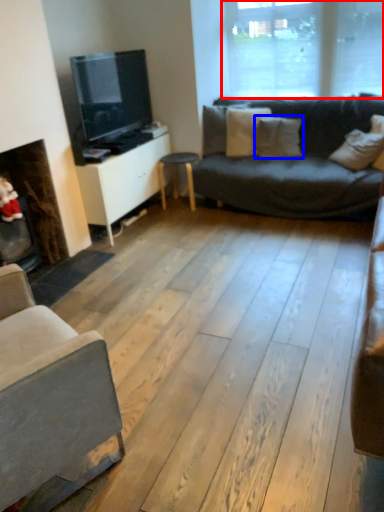
Question: Which object appears closest to the camera in this image, window (highlighted by a red box) or pillow (highlighted by a blue box)?

Choices:
 (A) window
 (B) pillow

Answer: (A)